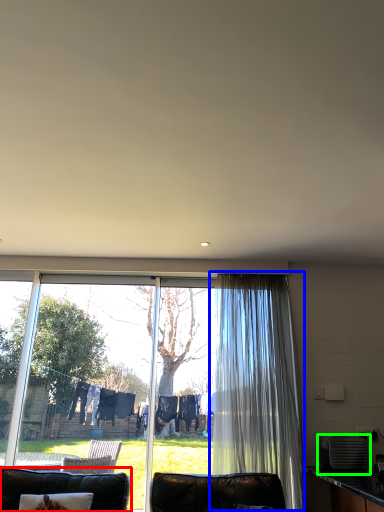
Question: Considering the real-world distances, which object is closest to furniture (highlighted by a red box)? curtain (highlighted by a blue box) or appliance (highlighted by a green box).

Choices:
 (A) curtain
 (B) appliance

Answer: (A)